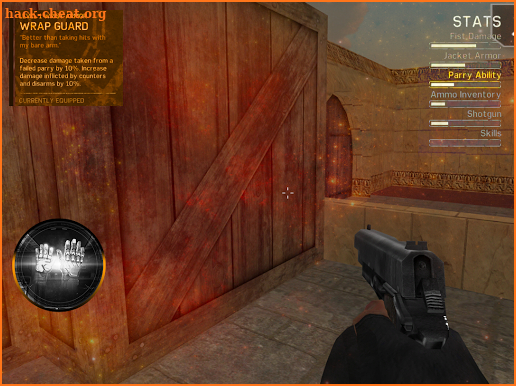
At what (x,y) coordinates should I click in order to perform the action: click on archway. Please return your answer as a coordinate pair (x, y). This screenshot has height=386, width=516. Looking at the image, I should click on (343, 142).